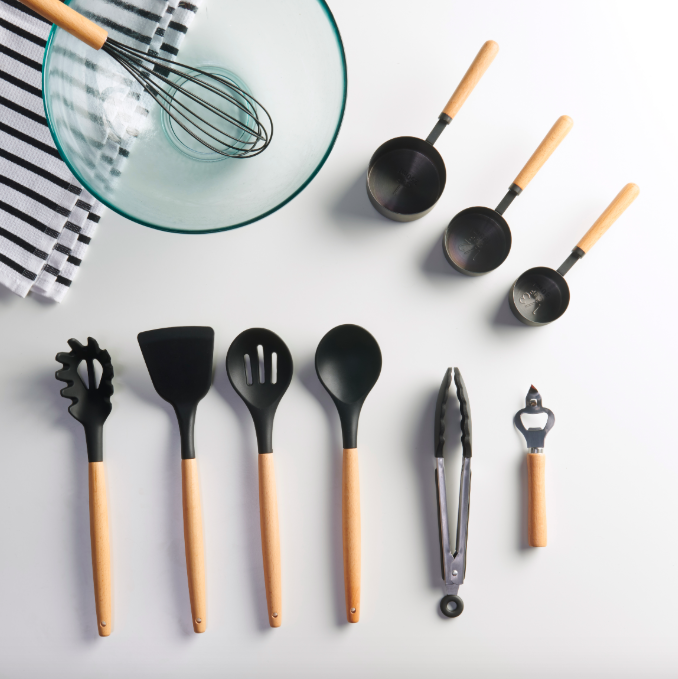
Where is `kitchen tools`? kitchen tools is located at coordinates (247, 354), (262, 528).